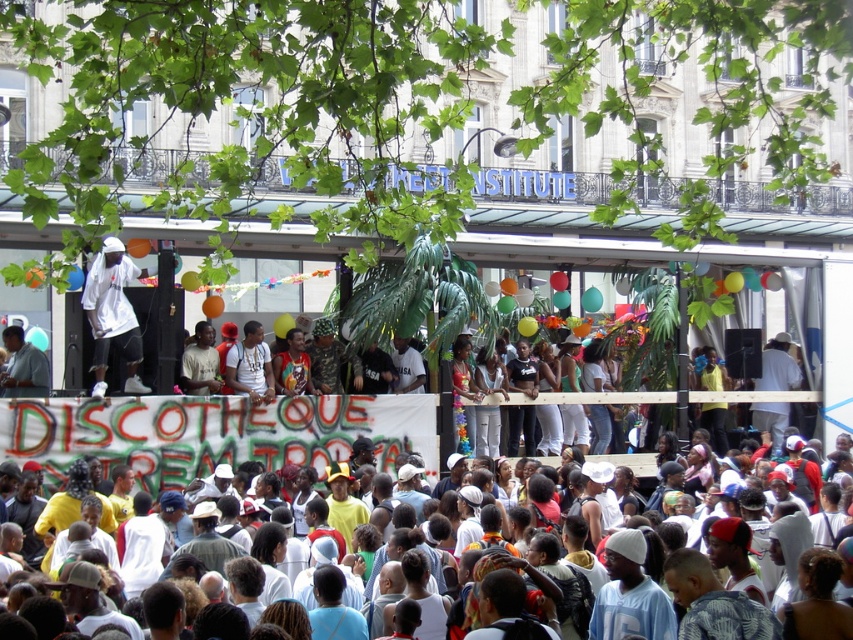
Which of these two, white cotton crowd at center or light blue shirt at lower left, stands taller?

With more height is white cotton crowd at center.

The width and height of the screenshot is (853, 640). What do you see at coordinates (56, 429) in the screenshot? I see `white cotton crowd at center` at bounding box center [56, 429].

Where is `white cotton crowd at center`? This screenshot has height=640, width=853. white cotton crowd at center is located at coordinates (56, 429).

Is white cotton crowd at center below white matte clothing at center?

Correct, white cotton crowd at center is located below white matte clothing at center.

Is white cotton crowd at center further to the viewer compared to white matte clothing at center?

No, white cotton crowd at center is closer to the viewer.

Is point (190, 454) closer to camera compared to point (108, 294)?

Yes, it is.

You are a GUI agent. You are given a task and a screenshot of the screen. Output one action in this format:
    pyautogui.click(x=<x>, y=<y>)
    Task: Click on the white cotton crowd at center
    
    Given the screenshot: What is the action you would take?
    pyautogui.click(x=56, y=429)

I want to click on white matte clothing at center, so click(x=113, y=314).

Looking at this image, is white matte clothing at center to the right of light blue shirt at lower left from the viewer's perspective?

Indeed, white matte clothing at center is positioned on the right side of light blue shirt at lower left.

Find the location of a particular element. This screenshot has height=640, width=853. white matte clothing at center is located at coordinates (113, 314).